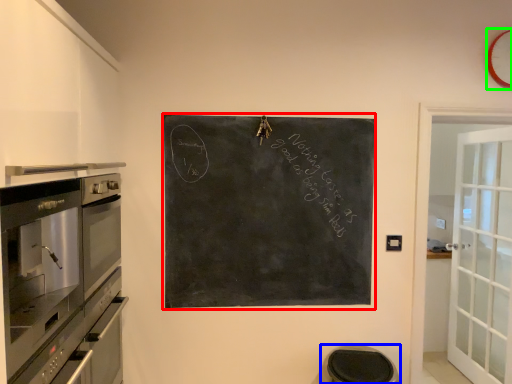
Question: Which object is the closest to the bulletin board (highlighted by a red box)? Choose among these: step stool (highlighted by a blue box) or clock (highlighted by a green box).

Choices:
 (A) step stool
 (B) clock

Answer: (A)